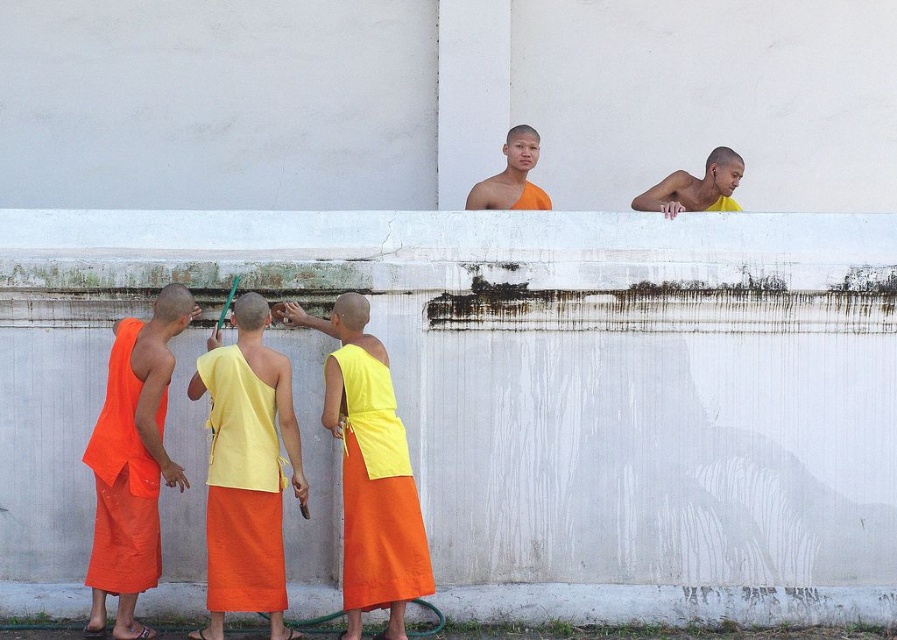
Who is higher up, yellow cotton robe at center or yellow matte monk at upper center?

yellow matte monk at upper center

Find the location of a particular element. yellow cotton robe at center is located at coordinates (377, 492).

Locate an element on the screen. yellow cotton robe at center is located at coordinates click(377, 492).

You are a GUI agent. You are given a task and a screenshot of the screen. Output one action in this format:
    pyautogui.click(x=<x>, y=<y>)
    Task: Click on the yellow cotton robe at center
    
    Given the screenshot: What is the action you would take?
    pyautogui.click(x=377, y=492)

Who is more forward, (215, 577) or (356, 470)?

Point (215, 577) is in front.

Looking at this image, between yellow matte cloth at center and yellow cotton robe at center, which one is positioned higher?

yellow cotton robe at center is above.

What do you see at coordinates (242, 486) in the screenshot? I see `yellow matte cloth at center` at bounding box center [242, 486].

Locate an element on the screen. yellow matte cloth at center is located at coordinates (242, 486).

Looking at this image, is yellow matte cloth at center to the left of orange cotton robe at left from the viewer's perspective?

No, yellow matte cloth at center is not to the left of orange cotton robe at left.

Does yellow matte cloth at center appear on the right side of orange cotton robe at left?

Correct, you'll find yellow matte cloth at center to the right of orange cotton robe at left.

Image resolution: width=897 pixels, height=640 pixels. I want to click on yellow matte cloth at center, so (x=242, y=486).

The image size is (897, 640). Find the location of `yellow matte cloth at center`. yellow matte cloth at center is located at coordinates (242, 486).